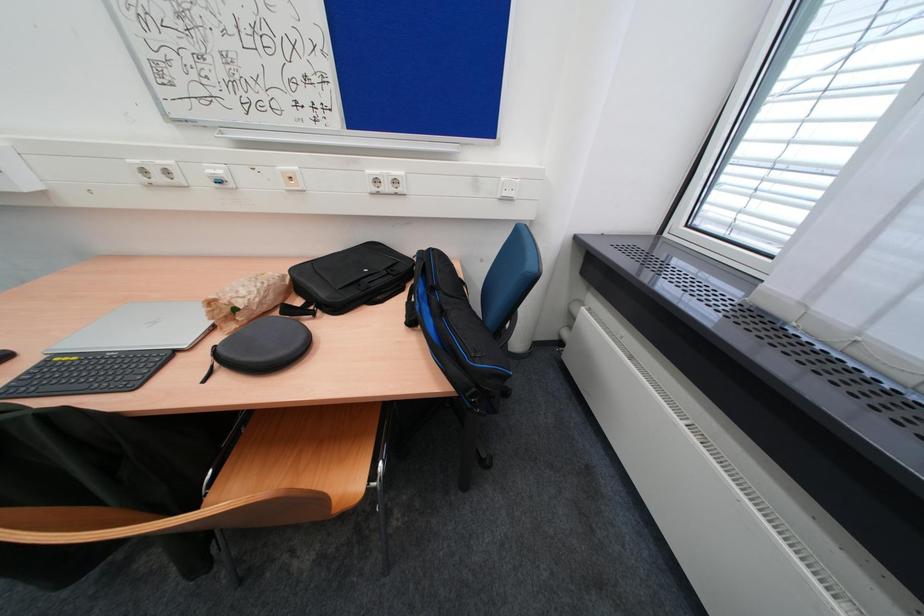
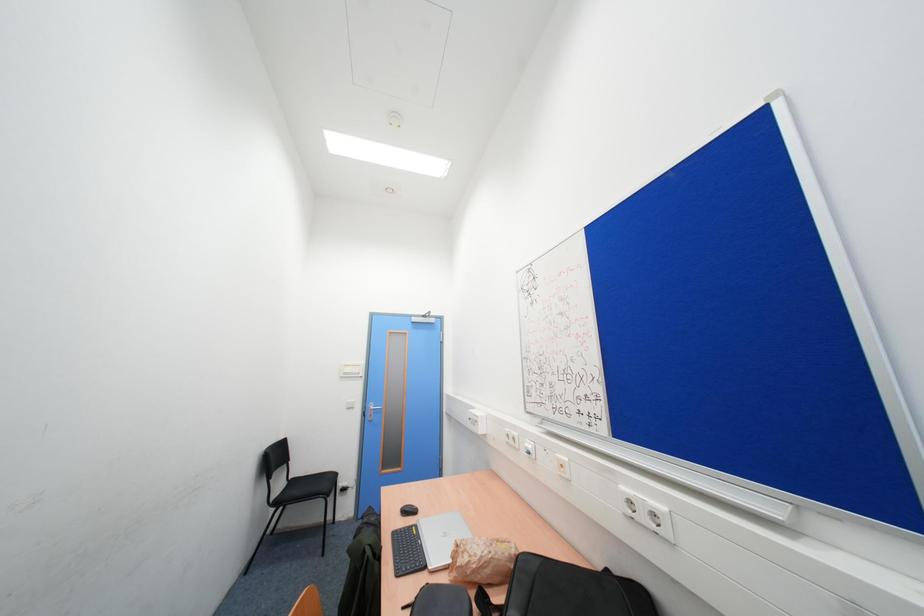
Based on the continuous images, in which direction is the camera rotating?

The camera's rotation is toward left-up.